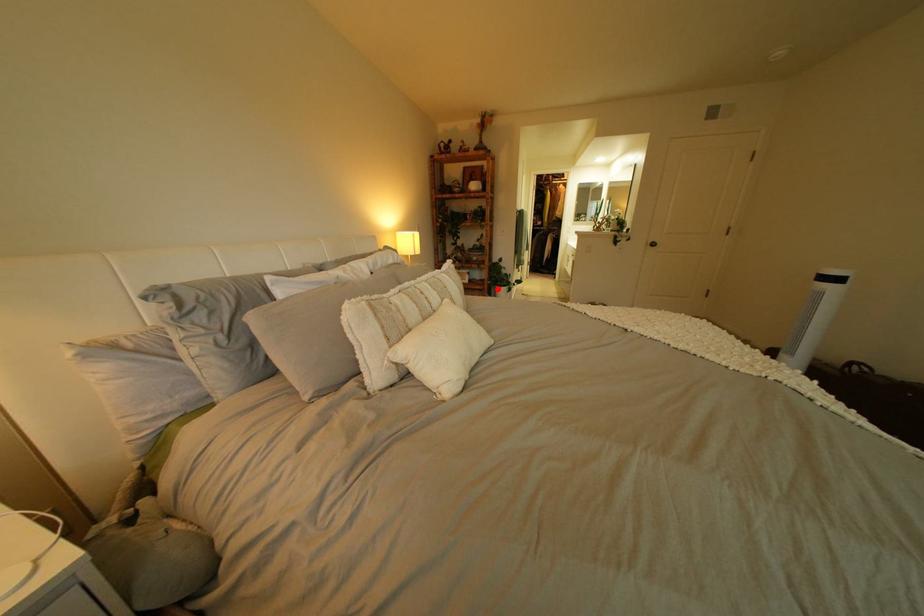
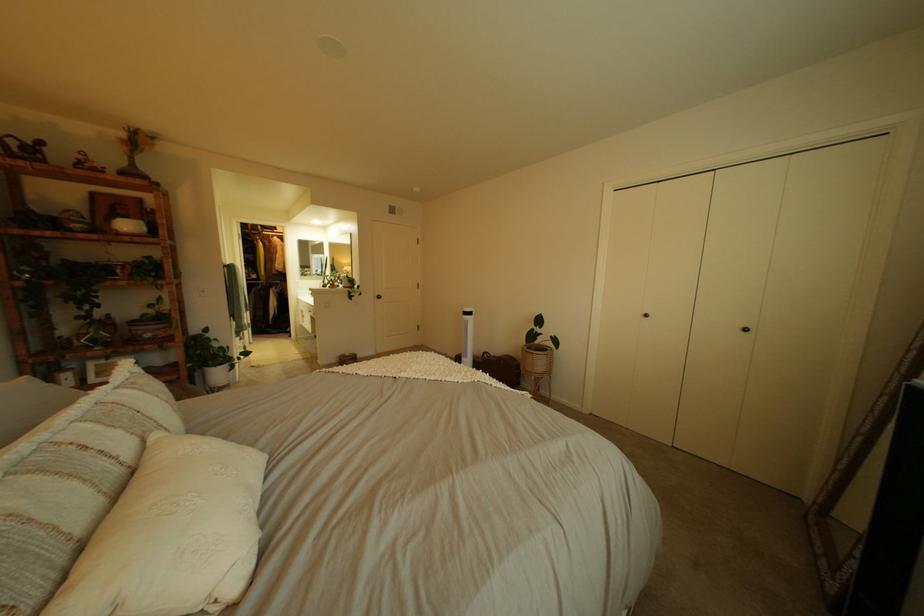
Question: I am providing you with two images of the same scene from different viewpoints. In image1, a red point is highlighted. Considering the same 3D point in image2, which of the following is correct?

Choices:
 (A) It is closer
 (B) It is farther

Answer: (A)